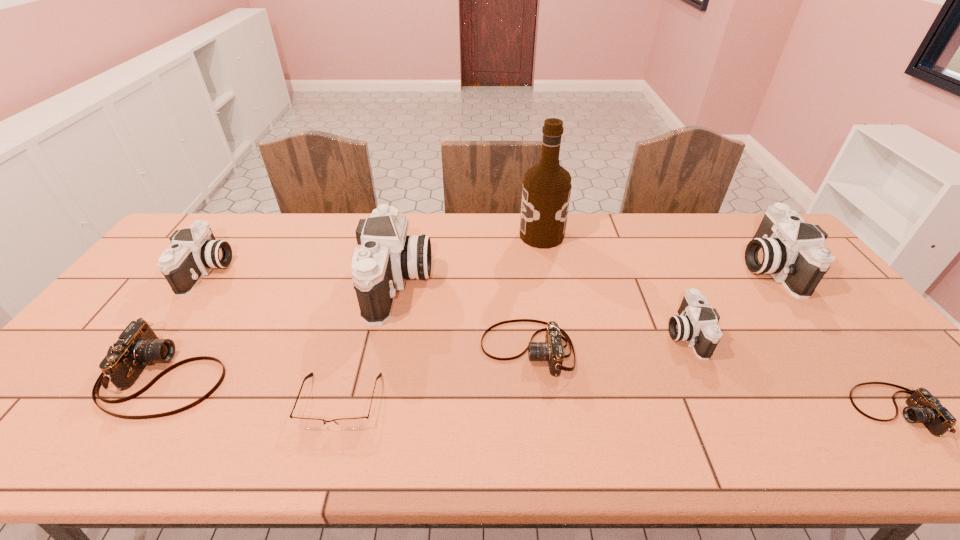
The image size is (960, 540). I want to click on brown alcohol, so (546, 191).

The width and height of the screenshot is (960, 540). In order to click on alcohol in this screenshot , I will do `click(546, 191)`.

Identify the location of the second black camera from left to right. This screenshot has width=960, height=540. (388, 256).

You are a GUI agent. You are given a task and a screenshot of the screen. Output one action in this format:
    pyautogui.click(x=<x>, y=<y>)
    Task: Click on the third camera from left to right
    
    Given the screenshot: What is the action you would take?
    pyautogui.click(x=388, y=256)

Find the location of `the sixth shortest camera`. the sixth shortest camera is located at coordinates (x=785, y=246).

Identify the location of the third tallest object. This screenshot has width=960, height=540. [x=785, y=246].

Locate an element on the screen. This screenshot has width=960, height=540. the fourth tallest object is located at coordinates (194, 252).

Image resolution: width=960 pixels, height=540 pixels. Find the location of `the leftmost black camera`. the leftmost black camera is located at coordinates (194, 252).

Where is `the fifth shortest object`? the fifth shortest object is located at coordinates 695,323.

The image size is (960, 540). Find the location of `the third object from right to left`. the third object from right to left is located at coordinates (695, 323).